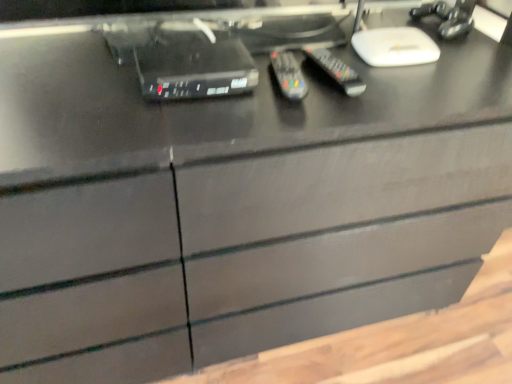
Where is `vacant space to the left of black plastic device at upper center`? The height and width of the screenshot is (384, 512). vacant space to the left of black plastic device at upper center is located at coordinates (85, 81).